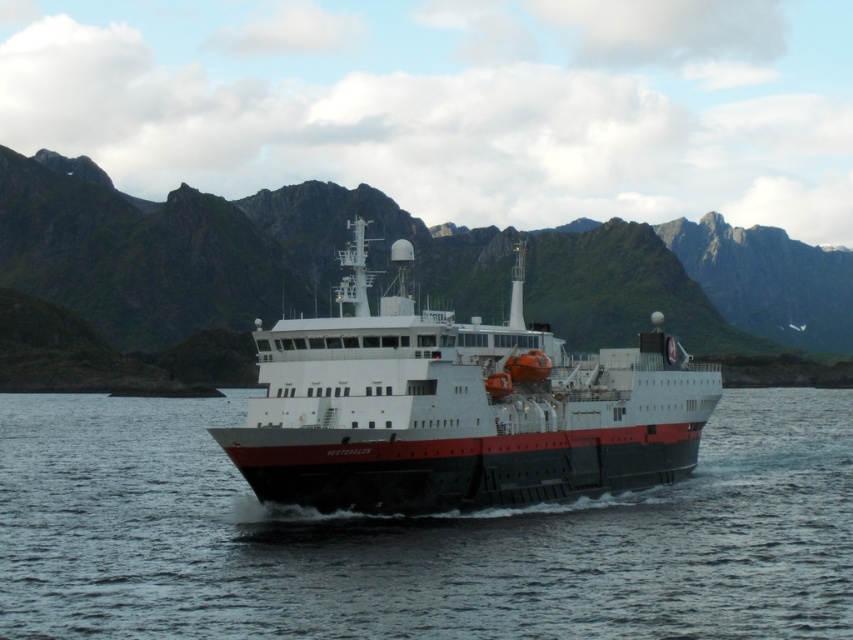
Is green grassy mountain at center wider than white matte ship at center?

Yes.

Is green grassy mountain at center to the left of white matte ship at center from the viewer's perspective?

Incorrect, green grassy mountain at center is not on the left side of white matte ship at center.

Who is more distant from viewer, (283, 241) or (357, 262)?

Positioned behind is point (283, 241).

Where is `green grassy mountain at center`? This screenshot has height=640, width=853. green grassy mountain at center is located at coordinates (193, 272).

Is black water at center positioned before white matte ship at center?

Yes.

Is point (48, 582) closer to viewer compared to point (416, 461)?

Yes.

Is point (242, 529) more distant than point (370, 396)?

Yes, point (242, 529) is behind point (370, 396).

You are a GUI agent. You are given a task and a screenshot of the screen. Output one action in this format:
    pyautogui.click(x=<x>, y=<y>)
    Task: Click on the black water at center
    This screenshot has width=853, height=640.
    Given the screenshot: What is the action you would take?
    (x=416, y=538)

Who is more distant from viewer, (251, 497) or (732, 289)?

The point (732, 289) is more distant.

Does black water at center appear over green grassy mountain at center?

No.

The image size is (853, 640). Find the location of `black water at center`. black water at center is located at coordinates click(x=416, y=538).